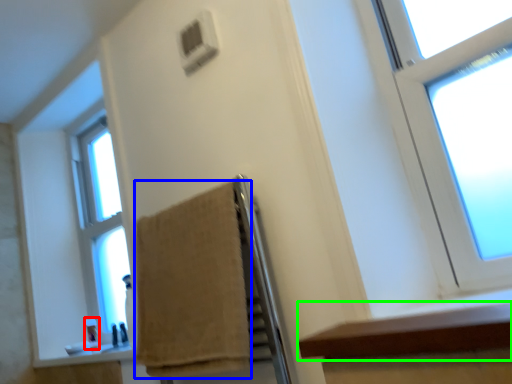
Question: Which is nearer to the toiletry (highlighted by a red box)? towel (highlighted by a blue box) or ledge (highlighted by a green box).

Choices:
 (A) towel
 (B) ledge

Answer: (A)